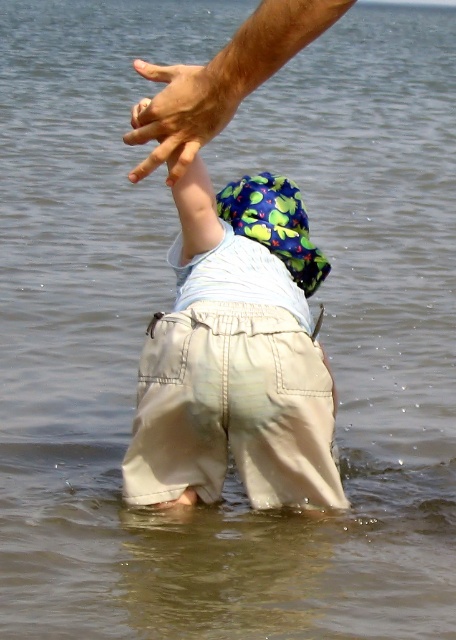
You are a photographer trying to capture the interaction between the child and the adult in the image. Based on the scene, which object is located beneath the other between the smooth tan skin at upper center and the smooth skin hand at upper center?

The smooth tan skin at upper center is positioned under the smooth skin hand at upper center, indicating the adult is supporting the child.

In the scene shown: You are a photographer trying to capture the scene. You notice the smooth tan skin at upper center and the smooth skin hand at upper center. Which object is wider?

The smooth tan skin at upper center might be wider than smooth skin hand at upper center according to the description.

Looking at this image, you are a photographer trying to capture a closeup shot of the smooth tan skin at upper center. Given that your camera has a minimum focusing distance of 10 feet, will you be able to take the photo without moving closer?

The smooth tan skin at upper center is 9.55 feet away from camera, which is closer than the minimum focusing distance of 10 feet. Therefore, you cannot take the photo without moving further away or adjusting your equipment.